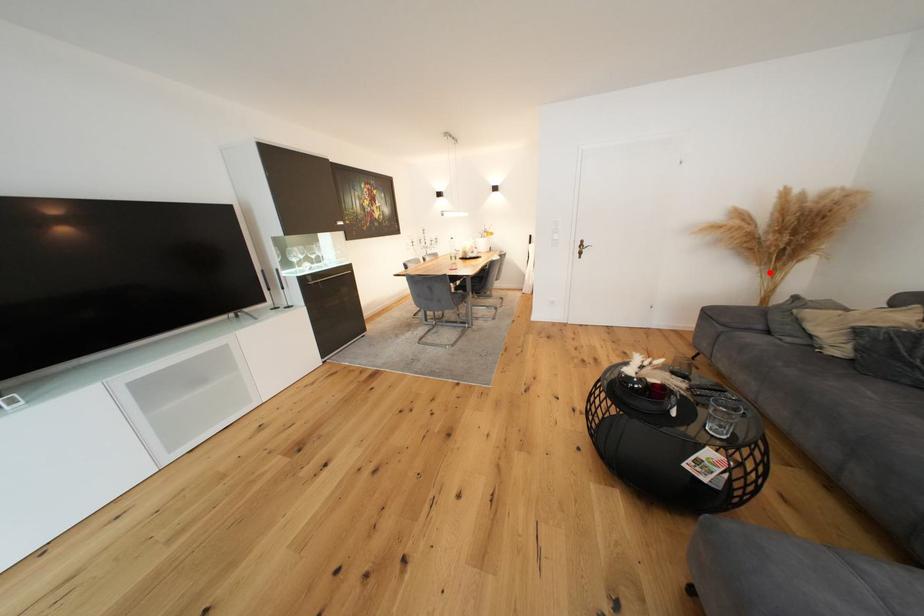
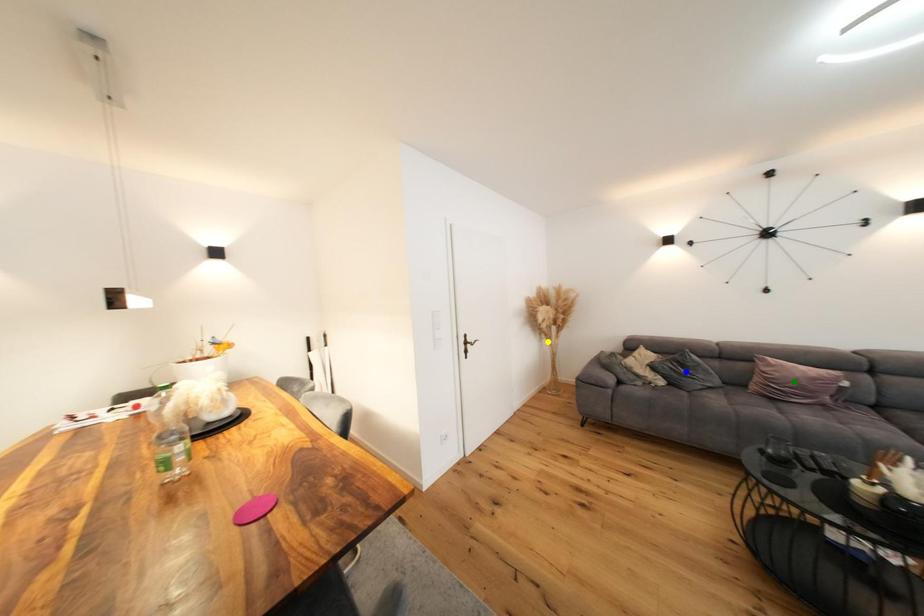
Question: I am providing you with two images of the same scene from different viewpoints. A red point is marked on the first image. You are given multiple points on the second image. Which mark in image 2 goes with the point in image 1?

Choices:
 (A) blue point
 (B) green point
 (C) yellow point

Answer: (C)